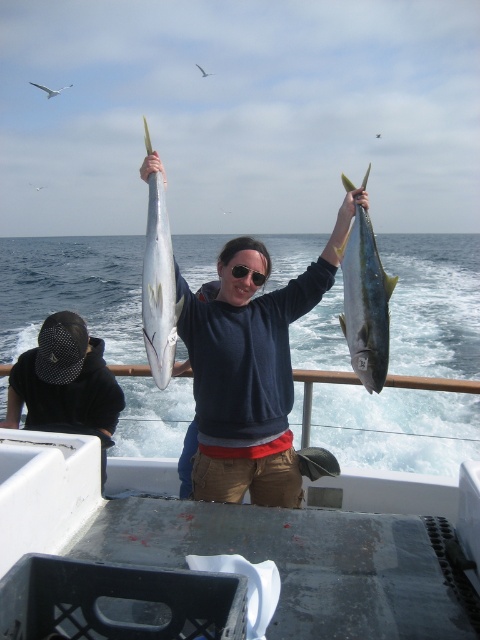
Question: Can you confirm if metallic gray boat at center is smaller than yellowish-green shiny fish at upper center?

Choices:
 (A) no
 (B) yes

Answer: (A)

Question: Does metallic gray boat at center have a greater width compared to shiny silver fish at upper center?

Choices:
 (A) yes
 (B) no

Answer: (A)

Question: Observing the image, what is the correct spatial positioning of metallic gray boat at center in reference to shiny silver fish at upper center?

Choices:
 (A) left
 (B) right

Answer: (B)

Question: Which point is farther to the camera?

Choices:
 (A) (152, 376)
 (B) (194, 390)

Answer: (B)

Question: Which of these objects is positioned farthest from the metallic gray boat at center?

Choices:
 (A) matte yellow fish at center
 (B) black plastic sunglasses at upper center
 (C) yellowish-green shiny fish at upper center

Answer: (B)

Question: Among these objects, which one is nearest to the camera?

Choices:
 (A) matte yellow fish at center
 (B) shiny silver fish at upper center
 (C) black fabric cap at lower left
 (D) yellowish-green shiny fish at upper center

Answer: (B)